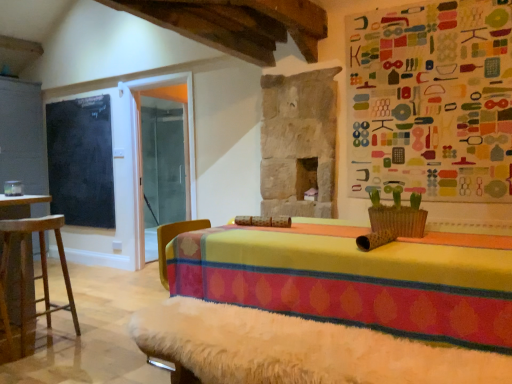
Question: Is black chalkboard at left to the left of wooden stool at left from the viewer's perspective?

Choices:
 (A) yes
 (B) no

Answer: (A)

Question: Considering the relative sizes of black chalkboard at left and wooden stool at left in the image provided, is black chalkboard at left taller than wooden stool at left?

Choices:
 (A) yes
 (B) no

Answer: (A)

Question: Is black chalkboard at left facing away from wooden stool at left?

Choices:
 (A) no
 (B) yes

Answer: (A)

Question: Can you confirm if black chalkboard at left is positioned to the right of wooden stool at left?

Choices:
 (A) no
 (B) yes

Answer: (A)

Question: From a real-world perspective, is black chalkboard at left physically above wooden stool at left?

Choices:
 (A) no
 (B) yes

Answer: (B)

Question: From their relative heights in the image, would you say black chalkboard at left is taller or shorter than wooden stool at left?

Choices:
 (A) short
 (B) tall

Answer: (B)

Question: Is black chalkboard at left to the left or to the right of wooden stool at left in the image?

Choices:
 (A) left
 (B) right

Answer: (A)

Question: From a real-world perspective, is black chalkboard at left physically located above or below wooden stool at left?

Choices:
 (A) above
 (B) below

Answer: (A)

Question: In terms of width, does black chalkboard at left look wider or thinner when compared to wooden stool at left?

Choices:
 (A) thin
 (B) wide

Answer: (A)

Question: Is point (20, 324) closer or farther from the camera than point (167, 324)?

Choices:
 (A) farther
 (B) closer

Answer: (A)

Question: From their relative heights in the image, would you say wooden stool at left is taller or shorter than white fur-covered bench at lower center?

Choices:
 (A) tall
 (B) short

Answer: (A)

Question: From the image's perspective, is wooden stool at left located above or below white fur-covered bench at lower center?

Choices:
 (A) above
 (B) below

Answer: (A)

Question: Looking at the image, does wooden stool at left seem bigger or smaller compared to white fur-covered bench at lower center?

Choices:
 (A) big
 (B) small

Answer: (B)

Question: From the image's perspective, is black chalkboard at left above or below white fur-covered bench at lower center?

Choices:
 (A) above
 (B) below

Answer: (A)

Question: In the image, is black chalkboard at left positioned in front of or behind white fur-covered bench at lower center?

Choices:
 (A) front
 (B) behind

Answer: (B)